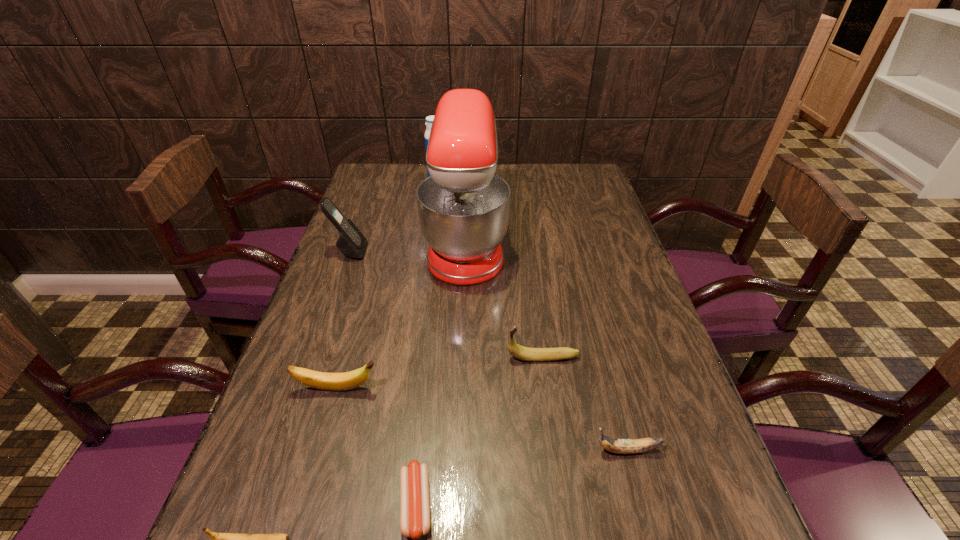
You are a GUI agent. You are given a task and a screenshot of the screen. Output one action in this format:
    pyautogui.click(x=<x>, y=<y>)
    Task: Click on the mixer
    Image resolution: width=960 pixels, height=540 pixels.
    Given the screenshot: What is the action you would take?
    pyautogui.click(x=463, y=206)

Where is `the seventh shortest object`? This screenshot has width=960, height=540. the seventh shortest object is located at coordinates (429, 119).

You are a GUI agent. You are given a task and a screenshot of the screen. Output one action in this format:
    pyautogui.click(x=<x>, y=<y>)
    Task: Click on the farthest object
    This screenshot has width=960, height=540.
    Given the screenshot: What is the action you would take?
    pyautogui.click(x=429, y=119)

Image resolution: width=960 pixels, height=540 pixels. Identify the location of cellular telephone. (351, 242).

You are a GUI agent. You are given a task and a screenshot of the screen. Output one action in this format:
    pyautogui.click(x=<x>, y=<y>)
    Task: Click on the fourth farthest object
    The width and height of the screenshot is (960, 540).
    Given the screenshot: What is the action you would take?
    pyautogui.click(x=520, y=352)

This screenshot has width=960, height=540. Find the location of `the third nearest banana`. the third nearest banana is located at coordinates (348, 380).

At what (x,y) coordinates should I click in order to perform the action: click on the sixth farthest object. Please return your answer as a coordinate pair (x, y). The width and height of the screenshot is (960, 540). Looking at the image, I should click on (619, 446).

Find the location of a particular element. This screenshot has height=540, width=960. vacant space located 0.110m on the front-facing side of the mixer is located at coordinates (543, 244).

Locate an element on the screen. This screenshot has width=960, height=540. free space located 0.360m on the front of the second tallest object is located at coordinates (427, 244).

Where is `vacant space located 0.080m on the front-facing side of the third tallest object`? This screenshot has width=960, height=540. vacant space located 0.080m on the front-facing side of the third tallest object is located at coordinates (394, 252).